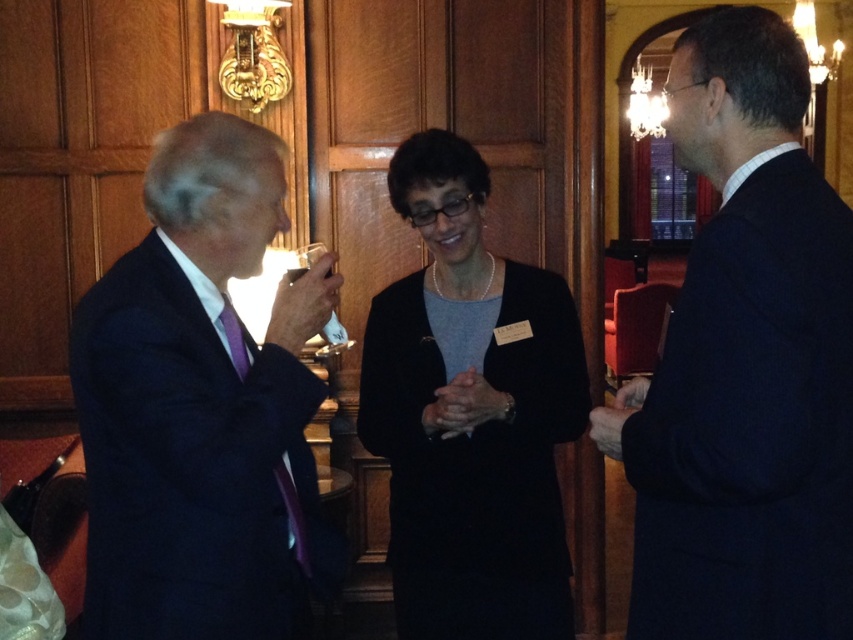
Question: Which point is closer to the camera?

Choices:
 (A) (683, 625)
 (B) (437, 368)
 (C) (183, 268)

Answer: (A)

Question: Based on their relative distances, which object is nearer to the matte black cardigan at center?

Choices:
 (A) dark blue suit at left
 (B) dark blue suit at right

Answer: (A)

Question: Is dark blue suit at left thinner than matte black cardigan at center?

Choices:
 (A) yes
 (B) no

Answer: (A)

Question: Does dark blue suit at right lie behind matte black cardigan at center?

Choices:
 (A) no
 (B) yes

Answer: (A)

Question: Which of the following is the farthest from the observer?

Choices:
 (A) click(x=383, y=371)
 (B) click(x=804, y=420)
 (C) click(x=158, y=413)

Answer: (A)

Question: Is dark blue suit at right smaller than matte black cardigan at center?

Choices:
 (A) no
 (B) yes

Answer: (A)